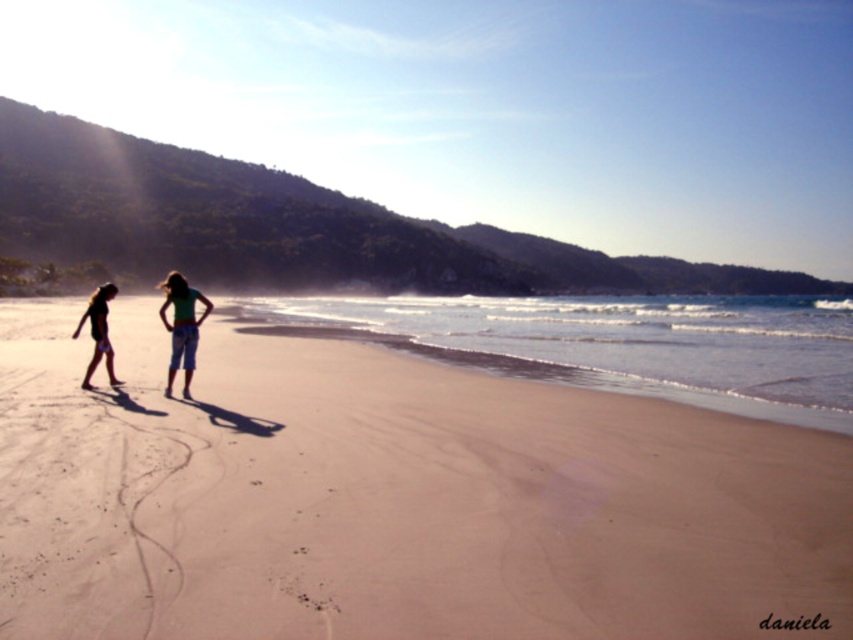
Locate an element on the screen. This screenshot has height=640, width=853. sandy shore at lower center is located at coordinates (622, 342).

Does point (660, 388) come in front of point (93, 307)?

No.

Find the location of a particular element. sandy shore at lower center is located at coordinates (622, 342).

Is sandy beach at center positioned behind green fabric shorts at center?

That is False.

Where is `sandy beach at center`? Image resolution: width=853 pixels, height=640 pixels. sandy beach at center is located at coordinates (392, 499).

This screenshot has width=853, height=640. I want to click on sandy beach at center, so click(x=392, y=499).

Can you confirm if green fabric shorts at center is positioned to the left of green cotton shorts at center?

Correct, you'll find green fabric shorts at center to the left of green cotton shorts at center.

Does green fabric shorts at center appear under green cotton shorts at center?

Indeed, green fabric shorts at center is positioned under green cotton shorts at center.

Between point (102, 333) and point (167, 394), which one is positioned behind?

Point (102, 333)

The height and width of the screenshot is (640, 853). Identify the location of green fabric shorts at center. (181, 326).